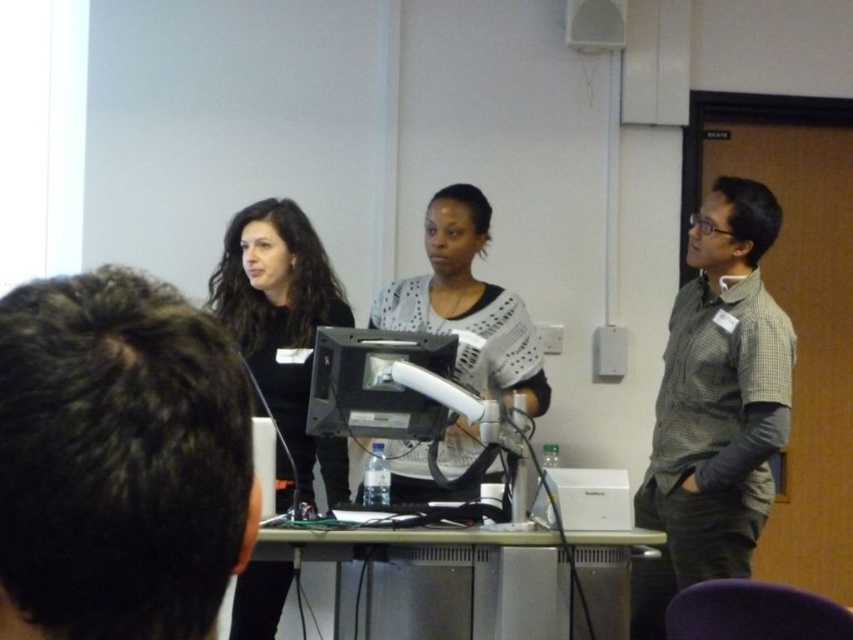
Question: Among these objects, which one is nearest to the camera?

Choices:
 (A) checkered fabric shirt at right
 (B) white dotted sweater at center
 (C) dark brown hair at upper left
 (D) matte black shirt at center

Answer: (C)

Question: Which of the following is the closest to the observer?

Choices:
 (A) dark brown hair at upper left
 (B) checkered fabric shirt at right
 (C) matte black shirt at center
 (D) white dotted sweater at center

Answer: (A)

Question: Considering the relative positions of dark brown hair at upper left and checkered fabric shirt at right in the image provided, where is dark brown hair at upper left located with respect to checkered fabric shirt at right?

Choices:
 (A) below
 (B) above

Answer: (B)

Question: Can you confirm if dark brown hair at upper left is positioned above checkered fabric shirt at right?

Choices:
 (A) yes
 (B) no

Answer: (A)

Question: Estimate the real-world distances between objects in this image. Which object is closer to the dark brown hair at upper left?

Choices:
 (A) white dotted sweater at center
 (B) checkered fabric shirt at right

Answer: (A)

Question: Is checkered fabric shirt at right bigger than matte black shirt at center?

Choices:
 (A) yes
 (B) no

Answer: (B)